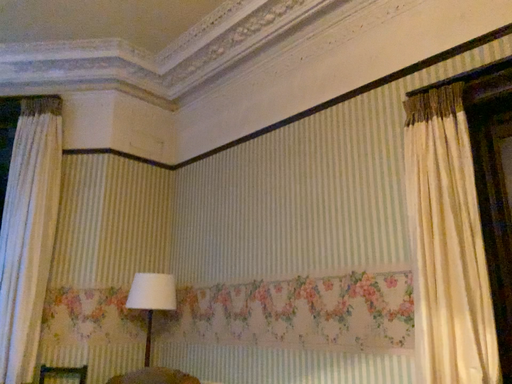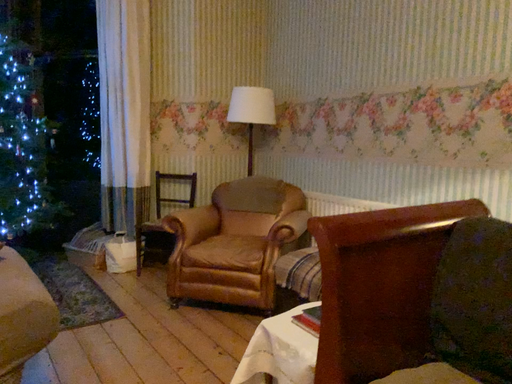
Question: How did the camera likely rotate when shooting the video?

Choices:
 (A) rotated upward
 (B) rotated downward

Answer: (B)